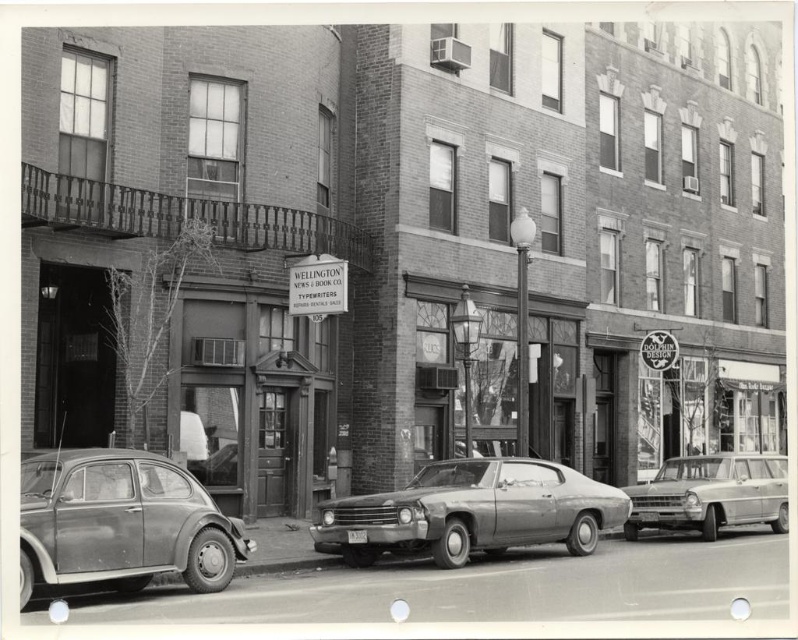
Question: Which of the following is the farthest from the observer?

Choices:
 (A) matte gray car at lower left
 (B) metallic gray sedan at center

Answer: (B)

Question: Does matte gray car at lower left come behind metallic gray sedan at center?

Choices:
 (A) yes
 (B) no

Answer: (B)

Question: Which of these objects is positioned closest to the metallic gray sedan at center?

Choices:
 (A) metallic silver station wagon at center
 (B) matte gray car at lower left

Answer: (B)

Question: Does metallic gray sedan at center have a greater width compared to metallic silver station wagon at center?

Choices:
 (A) no
 (B) yes

Answer: (B)

Question: Can you confirm if metallic gray sedan at center is thinner than metallic silver station wagon at center?

Choices:
 (A) yes
 (B) no

Answer: (B)

Question: Which point is farther from the camera taking this photo?

Choices:
 (A) (140, 534)
 (B) (595, 506)
 (C) (785, 460)

Answer: (C)